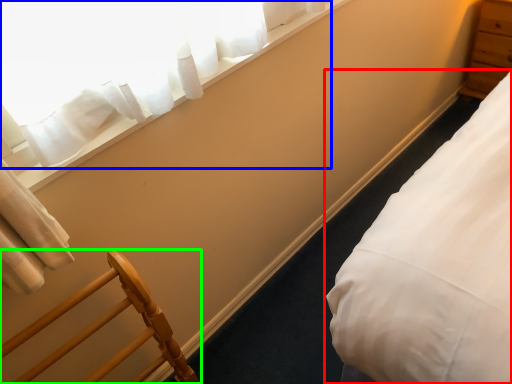
Question: Which object is the closest to the bed (highlighted by a red box)? Choose among these: curtain (highlighted by a blue box) or furniture (highlighted by a green box).

Choices:
 (A) curtain
 (B) furniture

Answer: (B)